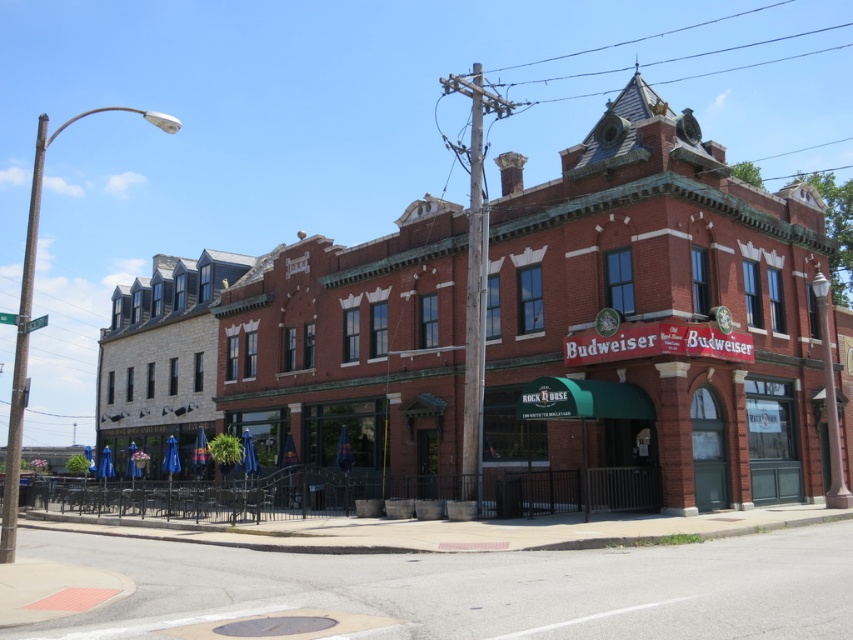
Question: Which of the following is the farthest from the observer?

Choices:
 (A) red brick building at center
 (B) concrete sidewalk at lower center

Answer: (A)

Question: Which of the following is the farthest from the observer?

Choices:
 (A) red brick building at center
 (B) concrete sidewalk at lower center

Answer: (A)

Question: Does red brick building at center appear under concrete sidewalk at lower center?

Choices:
 (A) yes
 (B) no

Answer: (B)

Question: Does red brick building at center appear on the left side of concrete sidewalk at lower center?

Choices:
 (A) yes
 (B) no

Answer: (A)

Question: Is red brick building at center thinner than concrete sidewalk at lower center?

Choices:
 (A) no
 (B) yes

Answer: (A)